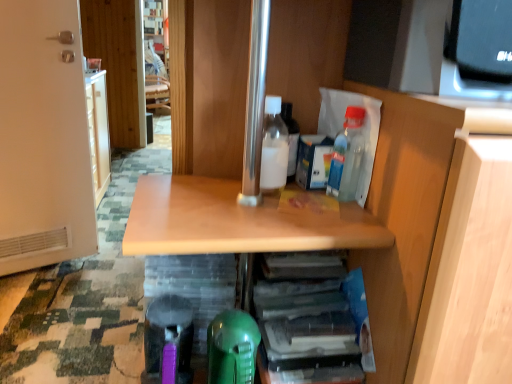
Question: From a real-world perspective, is translucent plastic bottle at upper right, placed as the second bottle when sorted from left to right, physically above translucent plastic stack of papers at lower center?

Choices:
 (A) yes
 (B) no

Answer: (A)

Question: Does translucent plastic bottle at upper right, which appears as the 1th bottle when viewed from the right, appear on the left side of translucent plastic stack of papers at lower center?

Choices:
 (A) yes
 (B) no

Answer: (B)

Question: Is translucent plastic bottle at upper right, which appears as the 1th bottle when viewed from the right, to the right of translucent plastic stack of papers at lower center from the viewer's perspective?

Choices:
 (A) no
 (B) yes

Answer: (B)

Question: Does translucent plastic bottle at upper right, which appears as the 1th bottle when viewed from the right, turn towards translucent plastic stack of papers at lower center?

Choices:
 (A) no
 (B) yes

Answer: (A)

Question: From a real-world perspective, is translucent plastic bottle at upper right, placed as the second bottle when sorted from left to right, located beneath translucent plastic stack of papers at lower center?

Choices:
 (A) no
 (B) yes

Answer: (A)

Question: Is translucent plastic bottle at upper right, which appears as the 1th bottle when viewed from the right, with translucent plastic stack of papers at lower center?

Choices:
 (A) no
 (B) yes

Answer: (A)

Question: From the image's perspective, is translucent plastic stack of papers at lower center on top of white matte bottle at center, which is the second bottle in right-to-left order?

Choices:
 (A) yes
 (B) no

Answer: (B)

Question: Does translucent plastic stack of papers at lower center turn towards white matte bottle at center, placed as the 1th bottle when sorted from left to right?

Choices:
 (A) no
 (B) yes

Answer: (A)

Question: Is translucent plastic stack of papers at lower center completely or partially outside of white matte bottle at center, which is the second bottle in right-to-left order?

Choices:
 (A) yes
 (B) no

Answer: (A)

Question: Would you say white matte bottle at center, which is the second bottle in right-to-left order, is part of translucent plastic stack of papers at lower center's contents?

Choices:
 (A) yes
 (B) no

Answer: (B)

Question: Does translucent plastic stack of papers at lower center appear on the right side of white matte bottle at center, placed as the 1th bottle when sorted from left to right?

Choices:
 (A) yes
 (B) no

Answer: (A)

Question: Can you confirm if translucent plastic stack of papers at lower center is positioned to the left of white matte bottle at center, placed as the 1th bottle when sorted from left to right?

Choices:
 (A) no
 (B) yes

Answer: (A)

Question: Considering the relative sizes of white matte bottle at center, placed as the 1th bottle when sorted from left to right, and white matte door at left in the image provided, is white matte bottle at center, placed as the 1th bottle when sorted from left to right, smaller than white matte door at left?

Choices:
 (A) yes
 (B) no

Answer: (A)